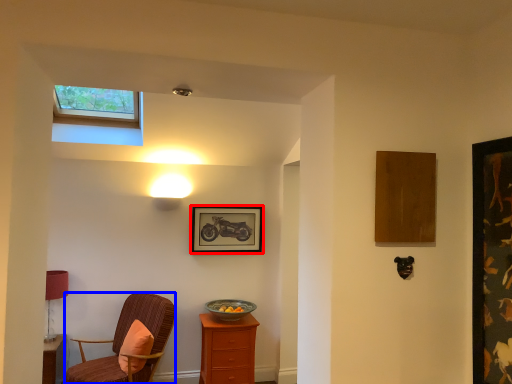
Question: Which object is closer to the camera taking this photo, picture frame (highlighted by a red box) or chair (highlighted by a blue box)?

Choices:
 (A) picture frame
 (B) chair

Answer: (B)